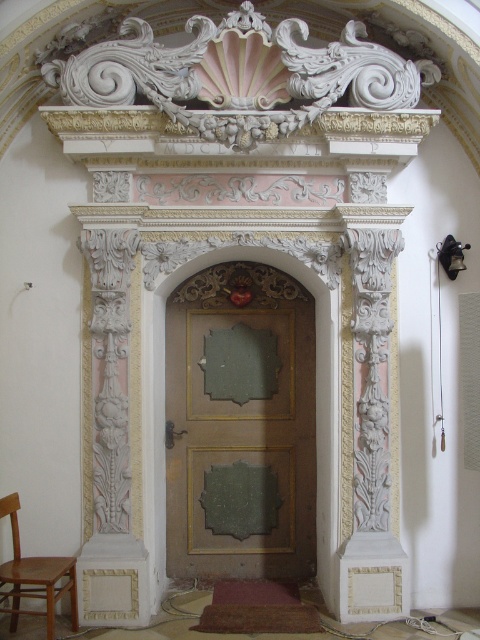
Question: Which point is closer to the camera?

Choices:
 (A) (263, 451)
 (B) (17, 568)

Answer: (B)

Question: Can you confirm if green wood door at center is positioned to the left of wooden chair at lower left?

Choices:
 (A) yes
 (B) no

Answer: (B)

Question: Which point is farther from the camera taking this photo?

Choices:
 (A) (201, 449)
 (B) (16, 531)

Answer: (A)

Question: Can you confirm if green wood door at center is positioned below wooden chair at lower left?

Choices:
 (A) yes
 (B) no

Answer: (B)

Question: Does green wood door at center have a greater width compared to wooden chair at lower left?

Choices:
 (A) no
 (B) yes

Answer: (B)